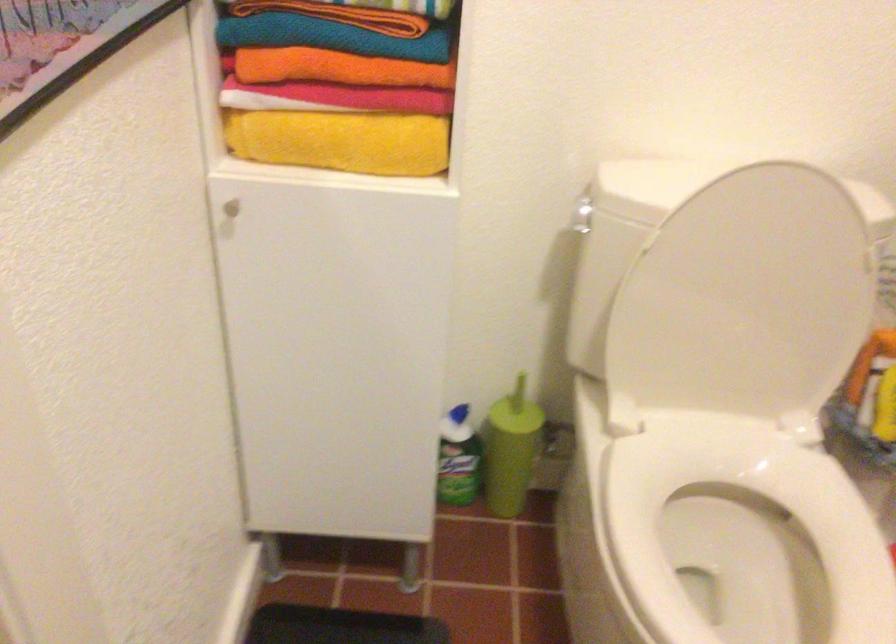
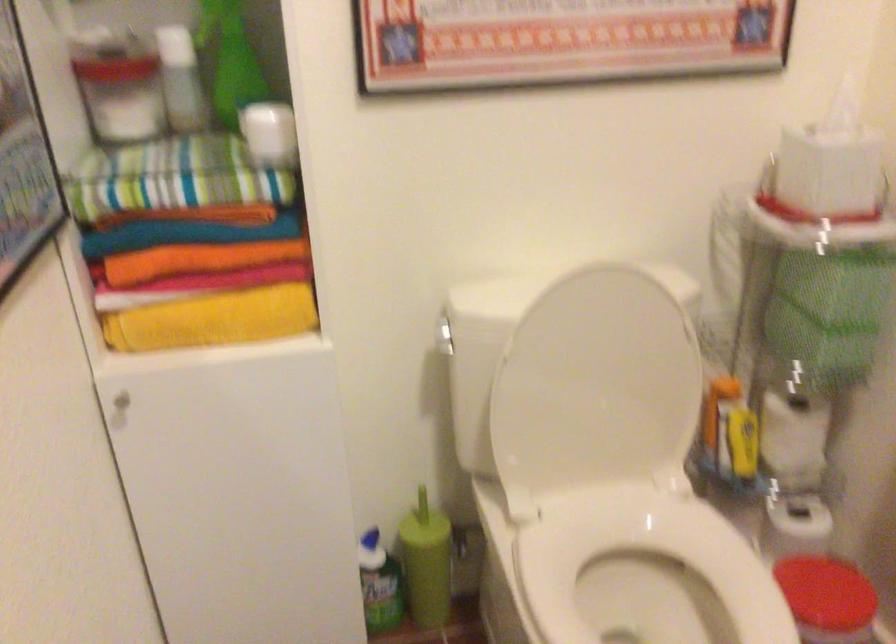
Find the pixel in the second image that matches (x=737, y=303) in the first image.

(595, 388)